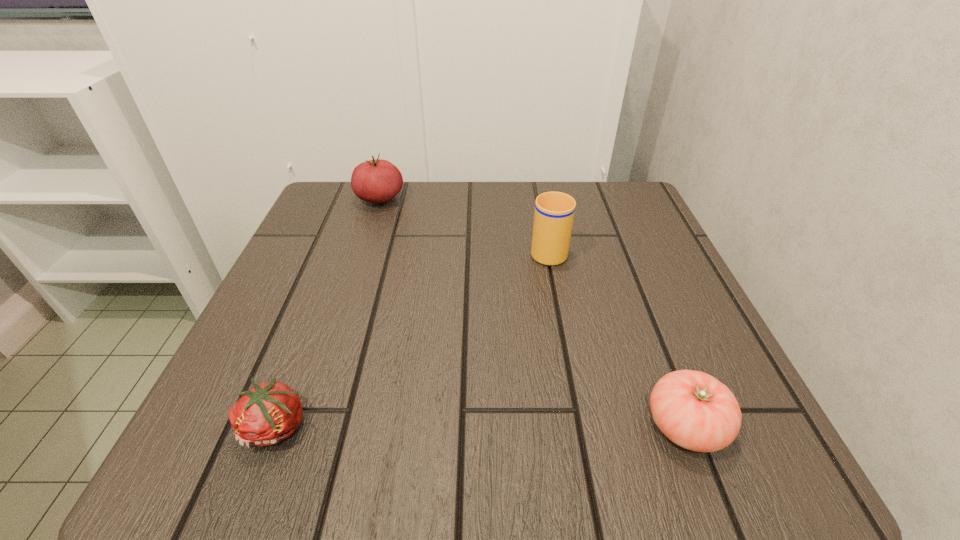
The height and width of the screenshot is (540, 960). Identify the location of the third nearest object. (554, 212).

Where is `cup`? The image size is (960, 540). cup is located at coordinates (554, 212).

Where is `the farthest tomato`? the farthest tomato is located at coordinates (376, 181).

In order to click on the tallest tomato in this screenshot , I will do `click(376, 181)`.

Locate an element on the screen. Image resolution: width=960 pixels, height=540 pixels. the rightmost object is located at coordinates (693, 409).

Identify the location of vacant region located on the side of the third object from left to right with the handle. The height and width of the screenshot is (540, 960). (535, 180).

Where is `blank area located on the side of the third object from left to right with the handle`? The image size is (960, 540). blank area located on the side of the third object from left to right with the handle is located at coordinates (541, 216).

The image size is (960, 540). Find the location of `free space located 0.080m on the side of the third object from left to right with the handle`. free space located 0.080m on the side of the third object from left to right with the handle is located at coordinates (541, 214).

Image resolution: width=960 pixels, height=540 pixels. In order to click on blank space located 0.130m on the front of the farthest tomato in this screenshot , I will do `click(364, 248)`.

Where is `free space located 0.360m on the left of the rightmost tomato`? This screenshot has width=960, height=540. free space located 0.360m on the left of the rightmost tomato is located at coordinates (373, 426).